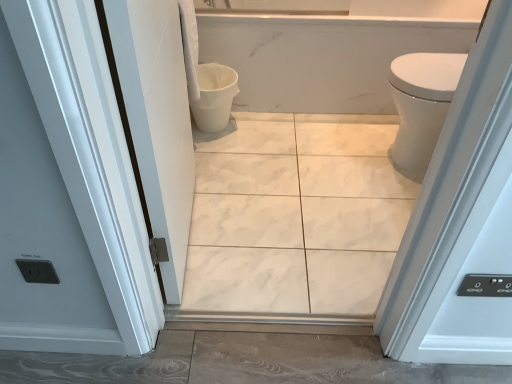
Image resolution: width=512 pixels, height=384 pixels. I want to click on free spot below white glossy door at left (from a real-world perspective), so click(188, 225).